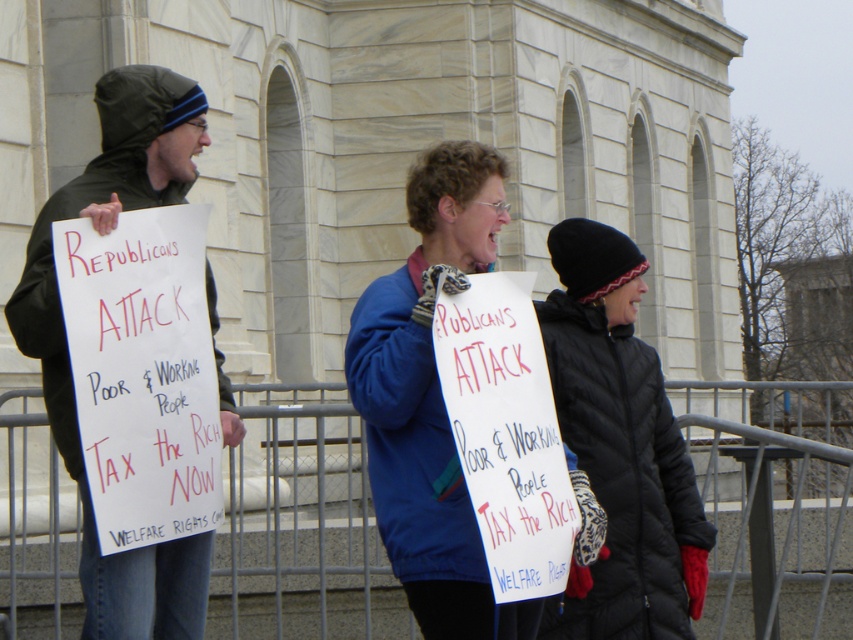
You are a photographer trying to capture a group photo of the blue fabric jacket at center and the dark green jacket at left. The minimum distance your camera can focus on two subjects is 13 feet. Will you be able to take a photo of both jackets clearly?

The blue fabric jacket at center and the dark green jacket at left are 13.35 feet apart. Since the minimum focusing distance is 13 feet, the photographer can take a clear photo of both jackets as the distance is slightly beyond the required minimum.